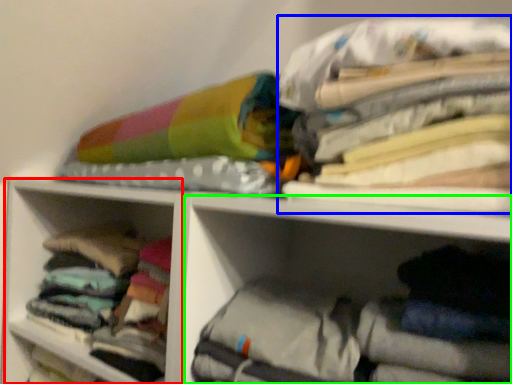
Question: Which is nearer to the cabinet (highlighted by a red box)? clothing (highlighted by a blue box) or cabinet (highlighted by a green box).

Choices:
 (A) clothing
 (B) cabinet

Answer: (B)